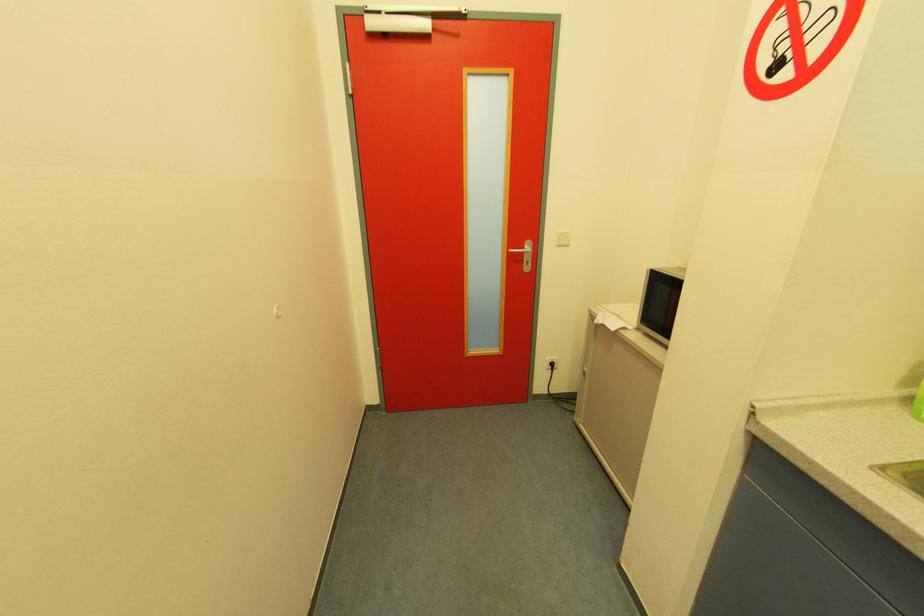
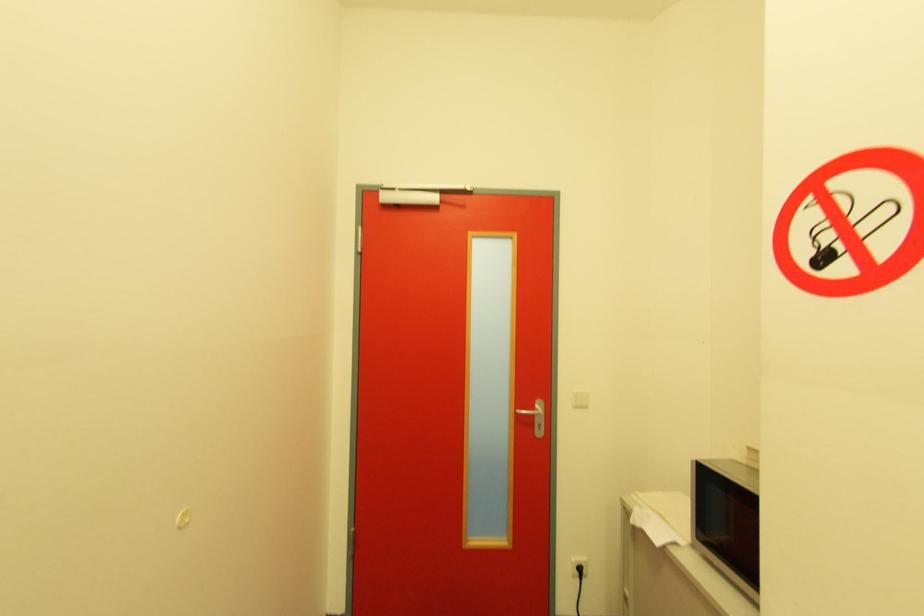
What movement of the cameraman would produce the second image?

The cameraman moved toward right, forward.